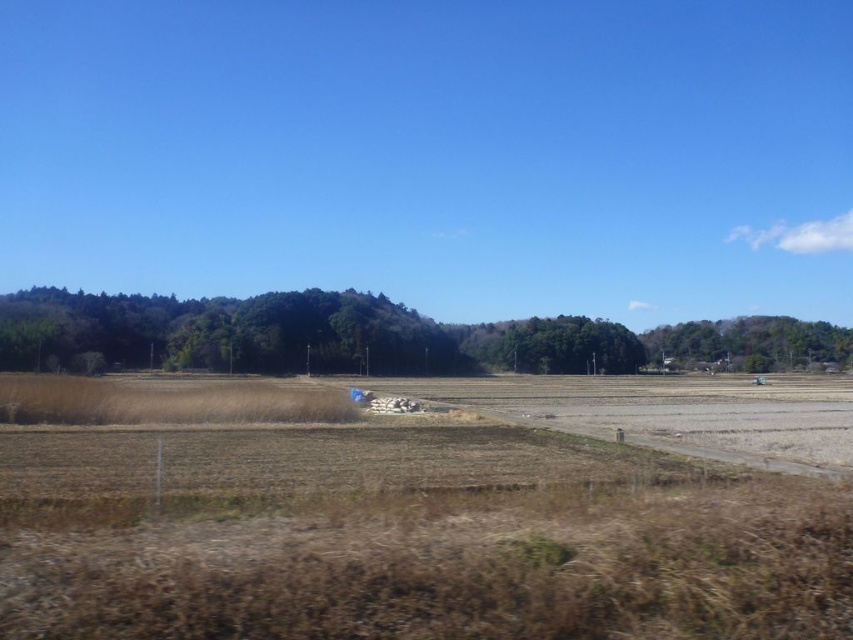
What do you see at coordinates (750, 342) in the screenshot? The image size is (853, 640). I see `green leafy tree at right` at bounding box center [750, 342].

Between point (758, 346) and point (630, 337), which one is positioned behind?

Point (758, 346)

Identify the location of green leafy tree at right. (750, 342).

Who is more forward, (720, 467) or (425, 317)?

Point (720, 467) is more forward.

Does brown dry grass at center come behind green leafy trees at left?

No, brown dry grass at center is in front of green leafy trees at left.

Is point (515, 508) more distant than point (338, 352)?

No, (515, 508) is closer to viewer.

The image size is (853, 640). Identify the location of brown dry grass at center. (444, 516).

Is brown dry grass at center closer to the viewer compared to green leafy tree at right?

Yes, it is in front of green leafy tree at right.

Which of these two, brown dry grass at center or green leafy tree at right, stands shorter?

brown dry grass at center is shorter.

Where is `brown dry grass at center`? brown dry grass at center is located at coordinates (444, 516).

Identify the location of brown dry grass at center. (444, 516).